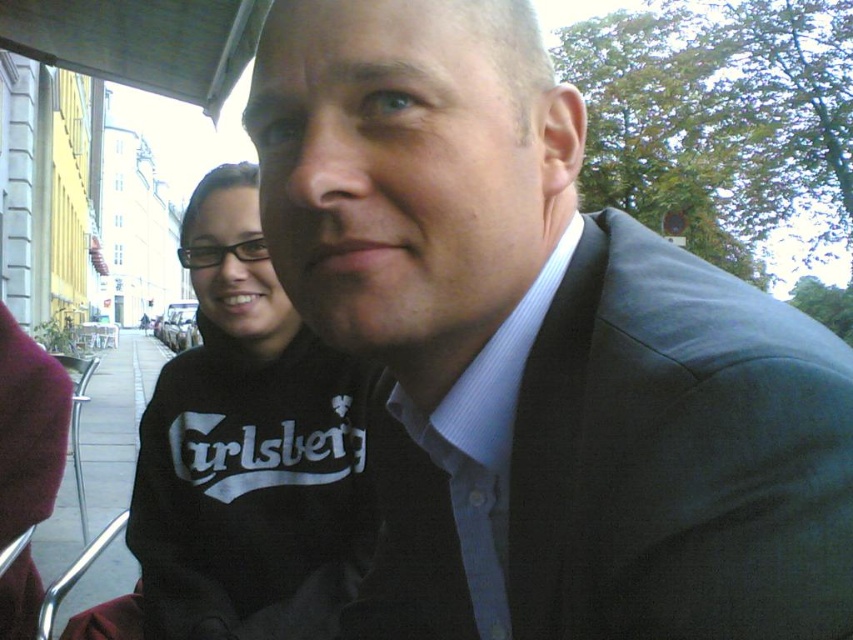
Is matte black suit at center thinner than black cotton sweatshirt at center?

Yes.

Is matte black suit at center taller than black cotton sweatshirt at center?

No, matte black suit at center is not taller than black cotton sweatshirt at center.

Identify the location of matte black suit at center. (538, 352).